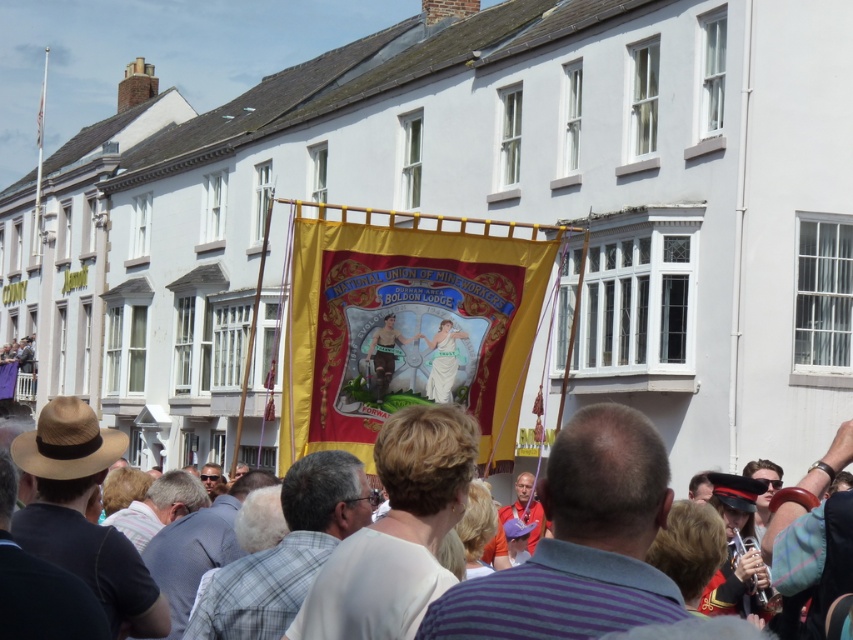
Between point (381, 385) and point (41, 122), which one is positioned in front?

Point (381, 385) is more forward.

Can you confirm if matte brown leather boots at center is bigger than yellow fabric banner at center?

Incorrect, matte brown leather boots at center is not larger than yellow fabric banner at center.

Is point (390, 353) farther from camera compared to point (44, 93)?

No, it is in front of (44, 93).

The width and height of the screenshot is (853, 640). I want to click on matte brown leather boots at center, so click(386, 353).

Does point (503, 284) come closer to viewer compared to point (42, 84)?

Yes, point (503, 284) is closer to viewer.

Image resolution: width=853 pixels, height=640 pixels. Identify the location of red velvet banner at center. (405, 332).

Can you confirm if white fabric at center is positioned above matte brown leather boots at center?

Yes.

Can you confirm if white fabric at center is positioned to the right of matte brown leather boots at center?

Correct, you'll find white fabric at center to the right of matte brown leather boots at center.

Does point (450, 353) come closer to viewer compared to point (386, 360)?

No, (450, 353) is further to viewer.

Locate an element on the screen. The width and height of the screenshot is (853, 640). white fabric at center is located at coordinates point(444,362).